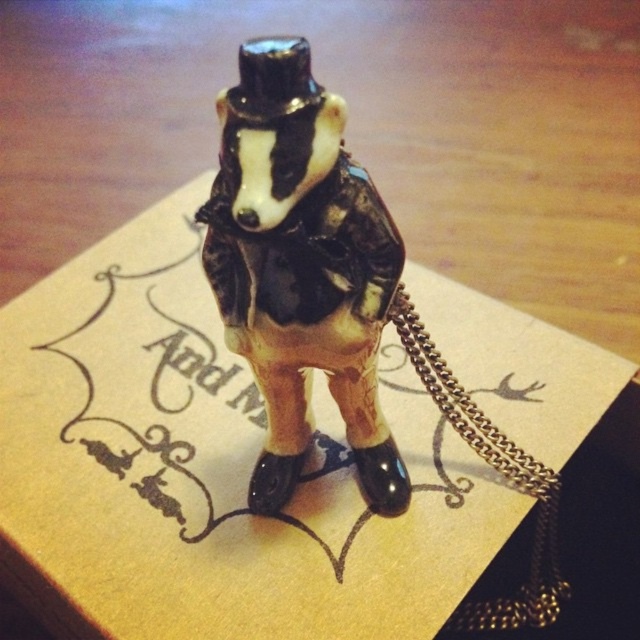
You are designing a display case for a miniature collection. The display case has a height limit of 5 cm. You have a porcelain badger at center and a gold chain at lower right. Based on their sizes, which item will exceed the height limit if placed vertically?

The porcelain badger at center is larger in size than the gold chain at lower right. Since the display case has a height limit of 5 cm, the porcelain badger at center may exceed the height limit, while the gold chain at lower right is smaller and likely within the limit.

You are a jeweler examining a pendant. You see the porcelain badger at center and the gold chain at lower right. Which object is placed above the other?

The porcelain badger at center is positioned over gold chain at lower right.